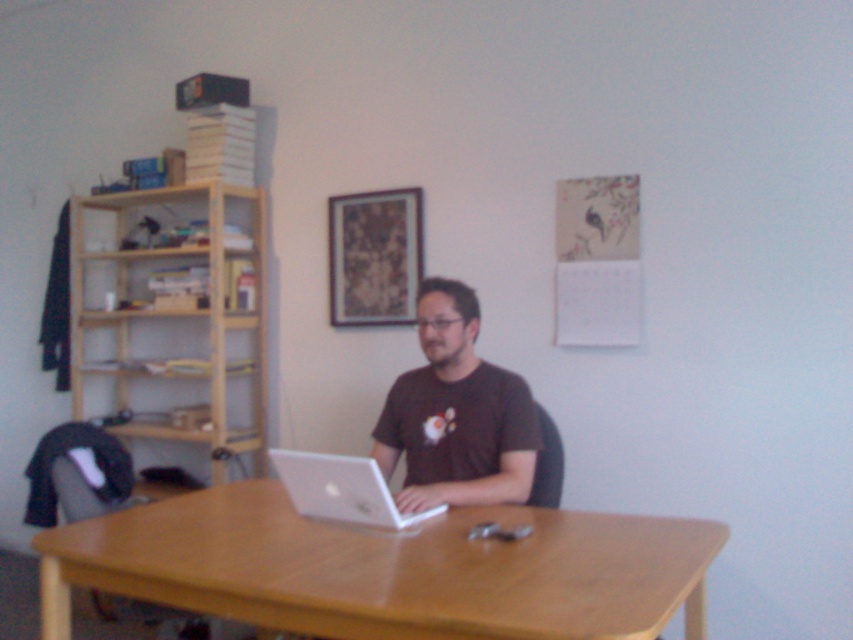
You are standing in the room and want to place a new plant on the closest surface to you. Which object should you choose between the light brown wood table at center and the light wood bookshelf at left?

The light brown wood table at center is closer to the viewer than the light wood bookshelf at left, so you should place the plant on the light brown wood table at center.

You are standing in the room and want to move from the light wood bookshelf at left to the light brown wood table at center. Which direction should you move towards?

You should move to the right to reach the light brown wood table at center from the light wood bookshelf at left since it is positioned to the right of it.